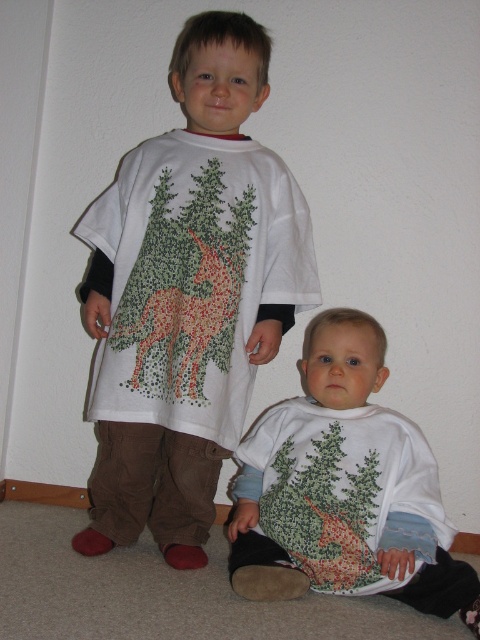
Can you confirm if white matte t-shirt at center is positioned below white soft fabric shirt at lower center?

Actually, white matte t-shirt at center is above white soft fabric shirt at lower center.

Which is behind, point (85, 289) or point (308, 531)?

Positioned behind is point (85, 289).

Identify the location of white matte t-shirt at center. This screenshot has height=640, width=480. 188,294.

This screenshot has width=480, height=640. I want to click on white matte t-shirt at center, so click(x=188, y=294).